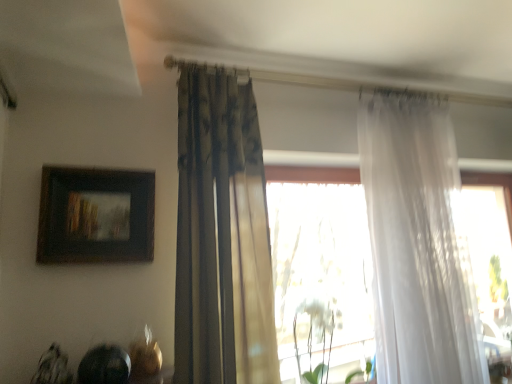
The height and width of the screenshot is (384, 512). Describe the element at coordinates (326, 346) in the screenshot. I see `white matte plant at center` at that location.

What do you see at coordinates (222, 236) in the screenshot? I see `textured beige curtain at center, which is counted as the first curtain, starting from the left` at bounding box center [222, 236].

Locate an element on the screen. Image resolution: width=512 pixels, height=384 pixels. white matte plant at center is located at coordinates (326, 346).

What are the coordinates of `plant located on the right of wooden framed painting at upper left` in the screenshot? It's located at (326, 346).

Considering the relative sizes of white matte plant at center and wooden framed painting at upper left in the image provided, is white matte plant at center smaller than wooden framed painting at upper left?

Actually, white matte plant at center might be larger than wooden framed painting at upper left.

Is white matte plant at center in front of wooden framed painting at upper left?

No.

Is textured beige curtain at center, which is counted as the first curtain, starting from the left, located within translucent white curtain at right, the second curtain viewed from the left?

No, textured beige curtain at center, which is counted as the first curtain, starting from the left, is not inside translucent white curtain at right, the second curtain viewed from the left.

Considering their positions, is translucent white curtain at right, the 1th curtain in the right-to-left sequence, located in front of or behind textured beige curtain at center, which ranks as the 2th curtain in right-to-left order?

Clearly, translucent white curtain at right, the 1th curtain in the right-to-left sequence, is behind textured beige curtain at center, which ranks as the 2th curtain in right-to-left order.

Where is `curtain in front of the translucent white curtain at right, the second curtain viewed from the left`? Image resolution: width=512 pixels, height=384 pixels. curtain in front of the translucent white curtain at right, the second curtain viewed from the left is located at coordinates (222, 236).

Considering the points (436, 267) and (271, 355), which point is in front, point (436, 267) or point (271, 355)?

Positioned in front is point (271, 355).

Identify the location of curtain lying behind the wooden framed painting at upper left. Image resolution: width=512 pixels, height=384 pixels. (418, 243).

From the image's perspective, relative to translucent white curtain at right, the 1th curtain in the right-to-left sequence, is wooden framed painting at upper left above or below?

From the image's perspective, wooden framed painting at upper left appears above translucent white curtain at right, the 1th curtain in the right-to-left sequence.

Is translucent white curtain at right, the 1th curtain in the right-to-left sequence, positioned behind white matte plant at center?

No, the depth of translucent white curtain at right, the 1th curtain in the right-to-left sequence, is less than that of white matte plant at center.

Locate an element on the screen. plant below the translucent white curtain at right, the second curtain viewed from the left (from a real-world perspective) is located at coordinates (326, 346).

Is translucent white curtain at right, the 1th curtain in the right-to-left sequence, oriented away from white matte plant at center?

No, translucent white curtain at right, the 1th curtain in the right-to-left sequence, is not facing away from white matte plant at center.

How different are the orientations of translucent white curtain at right, the 1th curtain in the right-to-left sequence, and white matte plant at center in degrees?

translucent white curtain at right, the 1th curtain in the right-to-left sequence, and white matte plant at center are facing 2.42 degrees away from each other.

Considering the relative positions of white matte plant at center and translucent white curtain at right, the second curtain viewed from the left, in the image provided, is white matte plant at center to the right of translucent white curtain at right, the second curtain viewed from the left, from the viewer's perspective?

No, white matte plant at center is not to the right of translucent white curtain at right, the second curtain viewed from the left.

Which object is closer to the camera taking this photo, white matte plant at center or translucent white curtain at right, the 1th curtain in the right-to-left sequence?

translucent white curtain at right, the 1th curtain in the right-to-left sequence, is more forward.

Which object is wider, white matte plant at center or translucent white curtain at right, the 1th curtain in the right-to-left sequence?

translucent white curtain at right, the 1th curtain in the right-to-left sequence.

Does point (330, 307) appear closer or farther from the camera than point (407, 282)?

Point (330, 307) is farther from the camera than point (407, 282).

Identify the location of the 2nd curtain above the white matte plant at center (from the image's perspective). The height and width of the screenshot is (384, 512). (222, 236).

Would you say white matte plant at center is inside or outside textured beige curtain at center, which is counted as the first curtain, starting from the left?

white matte plant at center is outside textured beige curtain at center, which is counted as the first curtain, starting from the left.

From a real-world perspective, is white matte plant at center above or below textured beige curtain at center, which ranks as the 2th curtain in right-to-left order?

In terms of real-world spatial position, white matte plant at center is below textured beige curtain at center, which ranks as the 2th curtain in right-to-left order.

Considering the relative sizes of white matte plant at center and textured beige curtain at center, which is counted as the first curtain, starting from the left, in the image provided, is white matte plant at center wider than textured beige curtain at center, which is counted as the first curtain, starting from the left,?

In fact, white matte plant at center might be narrower than textured beige curtain at center, which is counted as the first curtain, starting from the left.

Based on their sizes in the image, would you say textured beige curtain at center, which ranks as the 2th curtain in right-to-left order, is bigger or smaller than white matte plant at center?

Clearly, textured beige curtain at center, which ranks as the 2th curtain in right-to-left order, is larger in size than white matte plant at center.

Locate an element on the screen. The height and width of the screenshot is (384, 512). curtain that appears on the left of white matte plant at center is located at coordinates (222, 236).

Which object is further away from the camera taking this photo, textured beige curtain at center, which ranks as the 2th curtain in right-to-left order, or white matte plant at center?

white matte plant at center is behind.

Where is `plant below the wooden framed painting at upper left (from a real-world perspective)`? The width and height of the screenshot is (512, 384). plant below the wooden framed painting at upper left (from a real-world perspective) is located at coordinates (326, 346).

At what (x,y) coordinates should I click in order to perform the action: click on curtain behind the textured beige curtain at center, which ranks as the 2th curtain in right-to-left order. Please return your answer as a coordinate pair (x, y). Looking at the image, I should click on (418, 243).

Based on their spatial positions, is textured beige curtain at center, which ranks as the 2th curtain in right-to-left order, or wooden framed painting at upper left closer to translucent white curtain at right, the second curtain viewed from the left?

textured beige curtain at center, which ranks as the 2th curtain in right-to-left order.

Which object lies further to the anchor point white matte plant at center, translucent white curtain at right, the second curtain viewed from the left, or textured beige curtain at center, which is counted as the first curtain, starting from the left?

textured beige curtain at center, which is counted as the first curtain, starting from the left.

Based on their spatial positions, is textured beige curtain at center, which ranks as the 2th curtain in right-to-left order, or white matte plant at center closer to translucent white curtain at right, the 1th curtain in the right-to-left sequence?

white matte plant at center lies closer to translucent white curtain at right, the 1th curtain in the right-to-left sequence, than the other object.

When comparing their distances from translucent white curtain at right, the second curtain viewed from the left, does white matte plant at center or wooden framed painting at upper left seem further?

wooden framed painting at upper left lies further to translucent white curtain at right, the second curtain viewed from the left, than the other object.

From the image, which object appears to be farther from translucent white curtain at right, the second curtain viewed from the left, white matte plant at center or textured beige curtain at center, which is counted as the first curtain, starting from the left?

The object further to translucent white curtain at right, the second curtain viewed from the left, is textured beige curtain at center, which is counted as the first curtain, starting from the left.

Which object lies further to the anchor point textured beige curtain at center, which ranks as the 2th curtain in right-to-left order, translucent white curtain at right, the 1th curtain in the right-to-left sequence, or white matte plant at center?

Based on the image, translucent white curtain at right, the 1th curtain in the right-to-left sequence, appears to be further to textured beige curtain at center, which ranks as the 2th curtain in right-to-left order.

When comparing their distances from textured beige curtain at center, which is counted as the first curtain, starting from the left, does wooden framed painting at upper left or translucent white curtain at right, the 1th curtain in the right-to-left sequence, seem further?

translucent white curtain at right, the 1th curtain in the right-to-left sequence, is positioned further to the anchor textured beige curtain at center, which is counted as the first curtain, starting from the left.

Estimate the real-world distances between objects in this image. Which object is further from textured beige curtain at center, which ranks as the 2th curtain in right-to-left order, translucent white curtain at right, the second curtain viewed from the left, or wooden framed painting at upper left?

translucent white curtain at right, the second curtain viewed from the left, is positioned further to the anchor textured beige curtain at center, which ranks as the 2th curtain in right-to-left order.

Find the location of a particular element. plant located between textured beige curtain at center, which ranks as the 2th curtain in right-to-left order, and translucent white curtain at right, the second curtain viewed from the left, in the left-right direction is located at coordinates (326, 346).

This screenshot has width=512, height=384. Identify the location of curtain between wooden framed painting at upper left and white matte plant at center from left to right. (222, 236).

I want to click on curtain between wooden framed painting at upper left and translucent white curtain at right, the 1th curtain in the right-to-left sequence, so click(222, 236).

I want to click on plant located between wooden framed painting at upper left and translucent white curtain at right, the 1th curtain in the right-to-left sequence, in the left-right direction, so click(x=326, y=346).